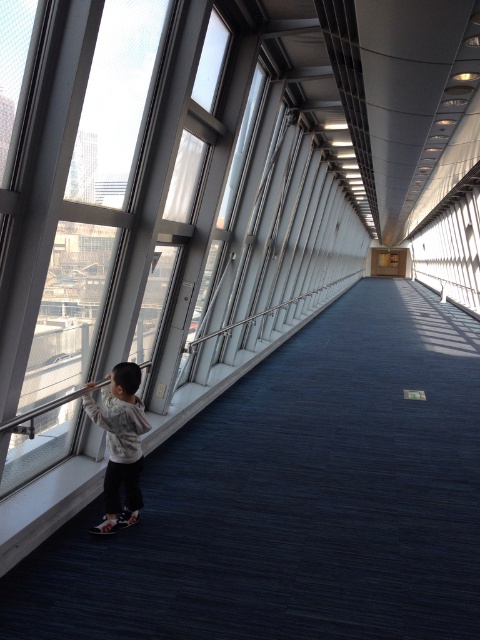
You are standing in the corridor and notice both the smooth concrete ledge at left and the light gray sweater at left. Which object takes up more space in the scene?

The smooth concrete ledge at left is bigger than the light gray sweater at left, so it takes up more space in the scene.

You are standing at the entrance of the corridor and notice a smooth concrete ledge at left located at point (46, 506). If you want to walk straight ahead towards the distant wall, will you encounter this ledge in your path?

The smooth concrete ledge at left is located at point (46, 506), which is to the left side of the corridor. Since you are walking straight ahead towards the distant wall, you will not encounter the ledge in your path as it is positioned to the side.